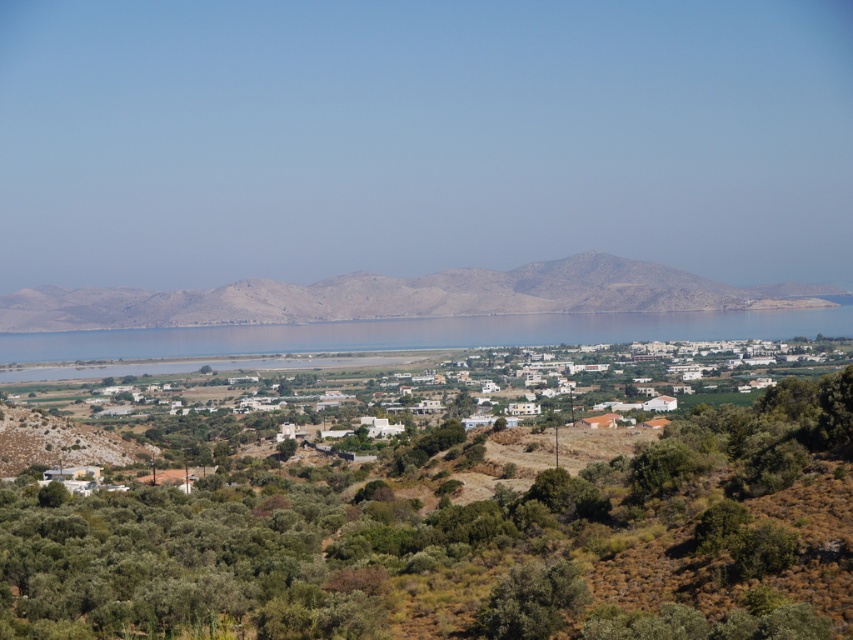
Question: Can you confirm if white matte houses at center is positioned to the right of dull brown mountain at center?

Choices:
 (A) no
 (B) yes

Answer: (B)

Question: Which of these objects is positioned closest to the blue water at center?

Choices:
 (A) white matte houses at center
 (B) dull brown mountain at center

Answer: (B)

Question: Considering the real-world distances, which object is closest to the dull brown mountain at center?

Choices:
 (A) white matte houses at center
 (B) blue water at center

Answer: (B)

Question: Can you confirm if white matte houses at center is smaller than dull brown mountain at center?

Choices:
 (A) no
 (B) yes

Answer: (A)

Question: Does white matte houses at center have a larger size compared to blue water at center?

Choices:
 (A) yes
 (B) no

Answer: (A)

Question: Which object appears farthest from the camera in this image?

Choices:
 (A) blue water at center
 (B) white matte houses at center

Answer: (A)